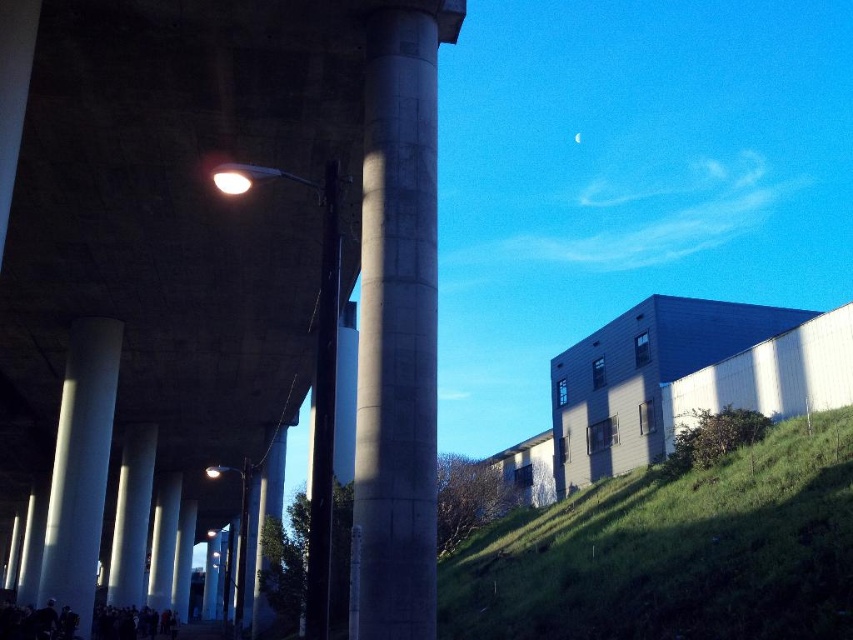
You are a painter needing to decide which object to paint first. If you want to paint the narrower object first, which one should you choose between the concrete at center and the black glossy pole at center?

The concrete at center is thinner than the black glossy pole at center, so you should paint the concrete at center first since it is narrower.